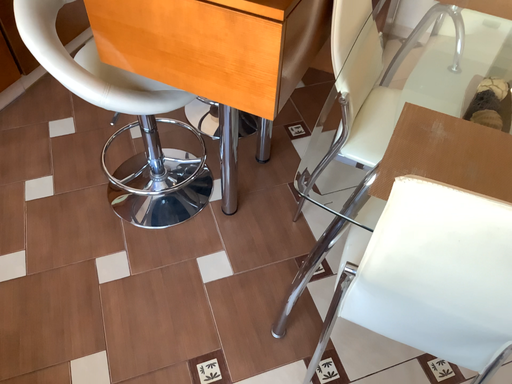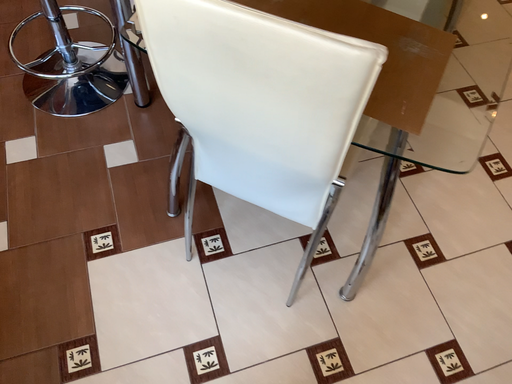
Question: How did the camera likely rotate when shooting the video?

Choices:
 (A) rotated downward
 (B) rotated upward

Answer: (A)